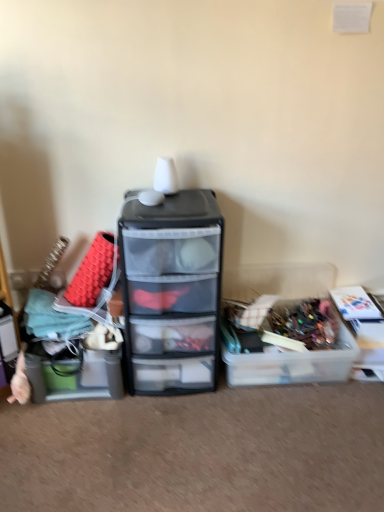
Identify the location of free space in front of transparent plastic drawers at center. The image size is (384, 512). (169, 434).